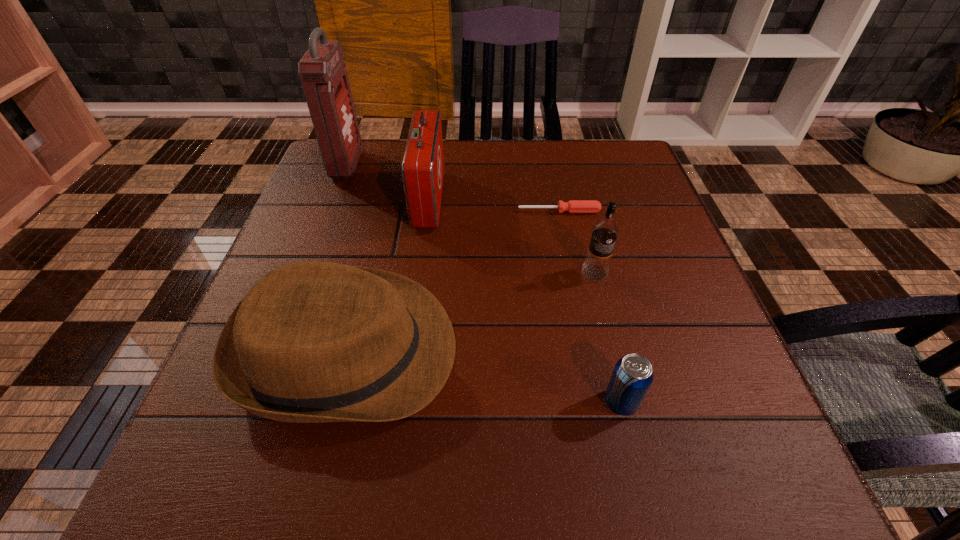
The width and height of the screenshot is (960, 540). Find the location of `vacant area located on the side of the shorter first-aid kit with the first aid cross symbol`. vacant area located on the side of the shorter first-aid kit with the first aid cross symbol is located at coordinates (564, 200).

You are a GUI agent. You are given a task and a screenshot of the screen. Output one action in this format:
    pyautogui.click(x=<x>, y=<y>)
    Task: Click on the free space located on the label of the fourth farthest object
    The height and width of the screenshot is (540, 960).
    Given the screenshot: What is the action you would take?
    pyautogui.click(x=630, y=411)

This screenshot has height=540, width=960. Identify the location of vacant space positioned on the front-facing side of the fedora. (532, 350).

The width and height of the screenshot is (960, 540). I want to click on free space located on the right of the second shortest object, so click(x=690, y=402).

This screenshot has width=960, height=540. In order to click on free spot located on the back of the screwdriver in this screenshot , I will do `click(552, 177)`.

Identify the location of the first-aid kit at the left edge. (323, 73).

Locate an element on the screen. fedora located at the left edge is located at coordinates (311, 342).

What are the coordinates of `vodka that is positioned at the right edge` in the screenshot? It's located at (605, 231).

Where is `screwdriver at the right edge`? The height and width of the screenshot is (540, 960). screwdriver at the right edge is located at coordinates (573, 206).

Identify the location of object at the far left corner. (323, 73).